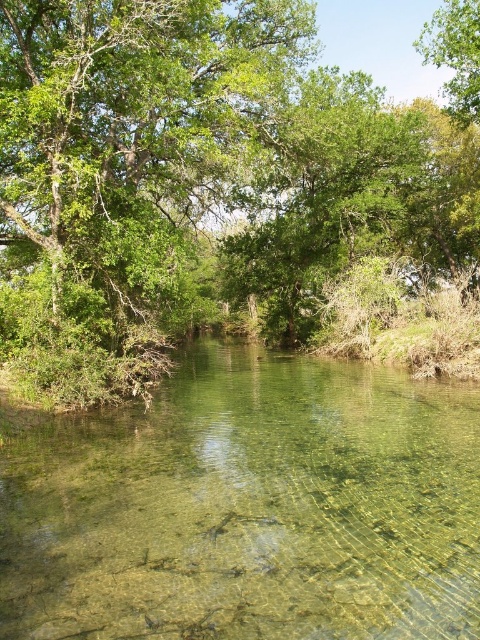
Consider the image. You are a hiker who wants to cross the clear glassy river at center. You notice a green leafy tree at upper right nearby. Which object is bigger in size between the two?

The clear glassy river at center has a smaller size compared to the green leafy tree at upper right, so the green leafy tree at upper right is bigger in size.

You are a hiker carrying a 1.5 meter wide tent. You want to set up camp between the green leafy tree at center and the clear glassy river at center. Is there enough space to place your tent without it overlapping either the tree or the river?

The distance between the green leafy tree at center and the clear glassy river at center is 12.89 meters. Since your tent is only 1.5 meters wide, there is ample space to place it between them without overlapping either the tree or the river.

You are a hiker trying to cross the clear glassy river at center using a fallen log. The green leafy tree at center is blocking your path. Can you estimate whether the tree is big enough to be used as a bridge to cross the river?

The green leafy tree at center has a larger size compared to clear glassy river at center, so yes, the tree is big enough to be used as a bridge to cross the river.